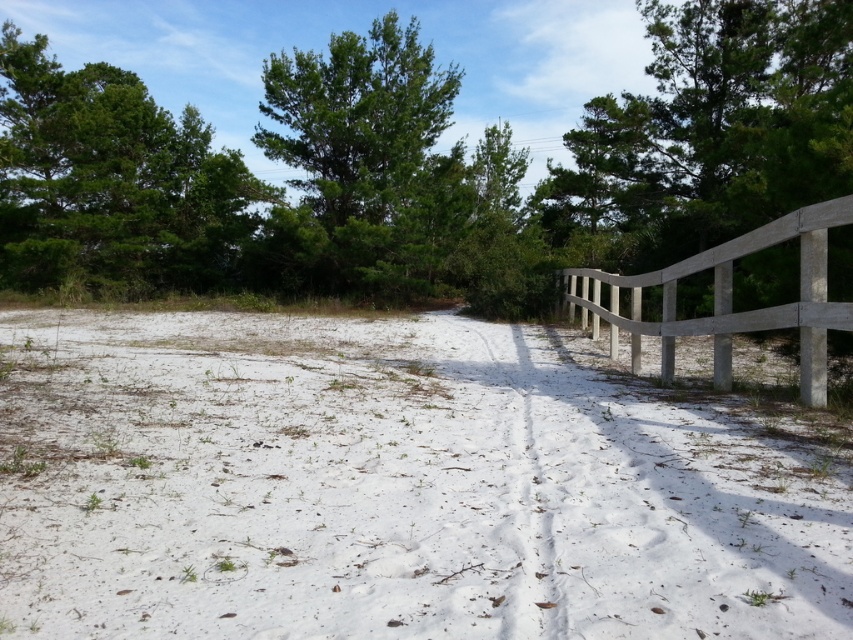
Question: Which of the following is the closest to the observer?

Choices:
 (A) (579, 305)
 (B) (248, 182)

Answer: (A)

Question: Among these points, which one is farthest from the camera?

Choices:
 (A) (827, 308)
 (B) (454, 177)
 (C) (62, 147)
 (D) (691, 84)

Answer: (B)

Question: Is white sandy path at center above green leafy tree at center?

Choices:
 (A) no
 (B) yes

Answer: (A)

Question: Considering the relative positions of green leafy tree at center and gray wooden fence at right in the image provided, where is green leafy tree at center located with respect to gray wooden fence at right?

Choices:
 (A) right
 (B) left

Answer: (B)

Question: Which point is closer to the camera taking this photo?

Choices:
 (A) (396, 552)
 (B) (212, 189)
 (C) (839, 67)

Answer: (A)

Question: Can you confirm if white sandy path at center is positioned to the left of green leafy tree at upper center?

Choices:
 (A) no
 (B) yes

Answer: (A)